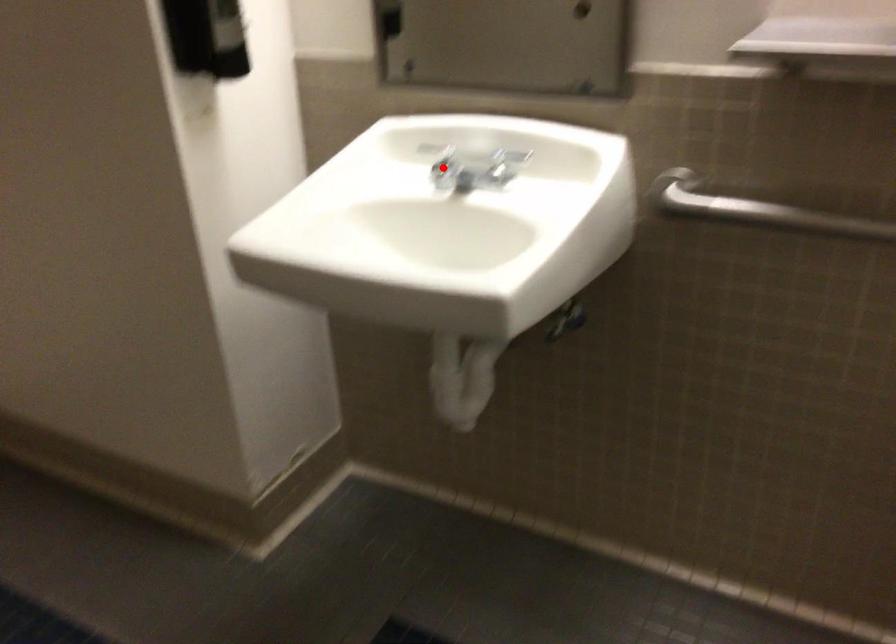
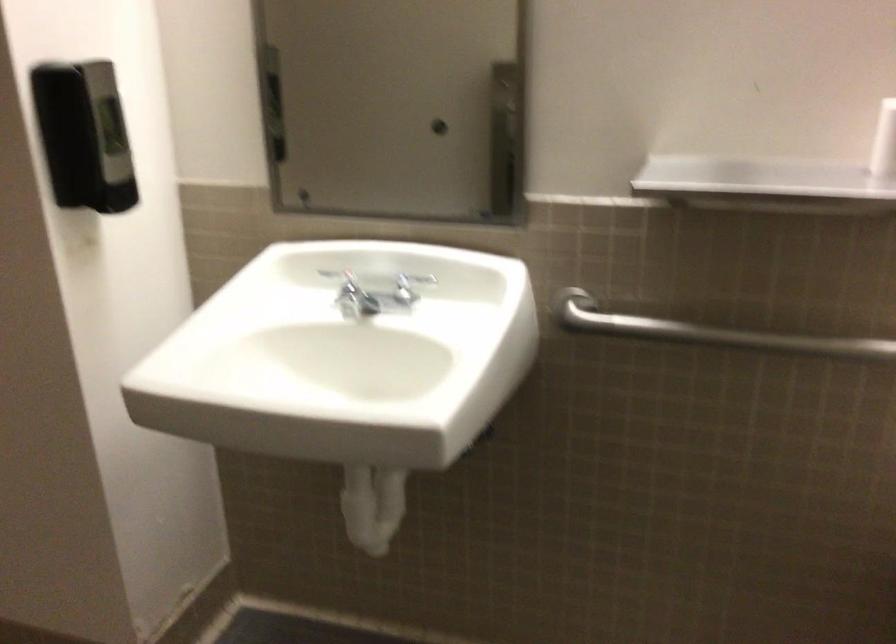
Find the pixel in the second image that matches the highlighted location in the first image.

(346, 290)